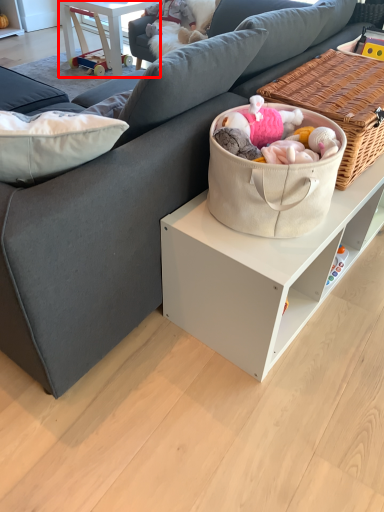
Question: Observing the image, what is the correct spatial positioning of table (annotated by the red box) in reference to picnic basket?

Choices:
 (A) left
 (B) right

Answer: (A)